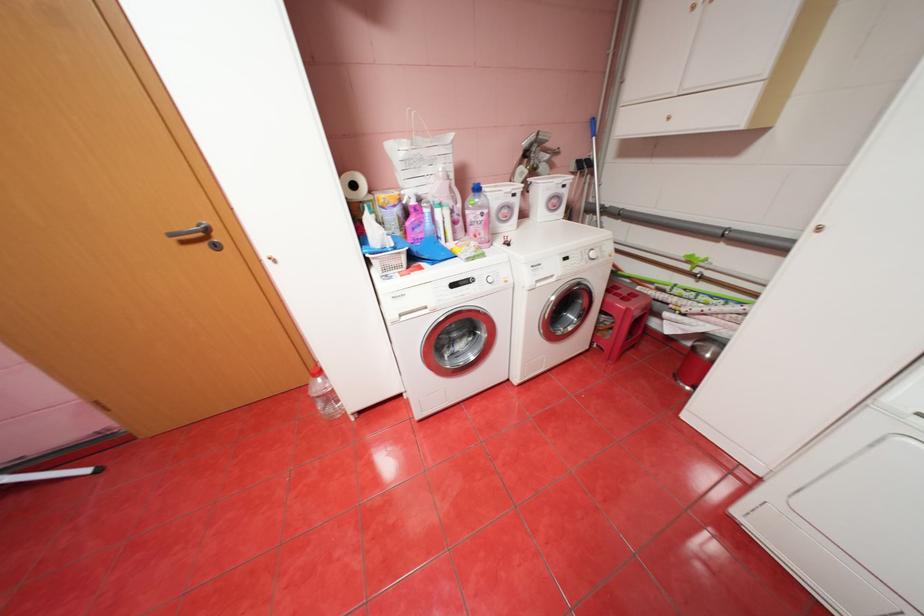
Locate an element on the screen. The image size is (924, 616). chair sitting surface is located at coordinates (635, 297).